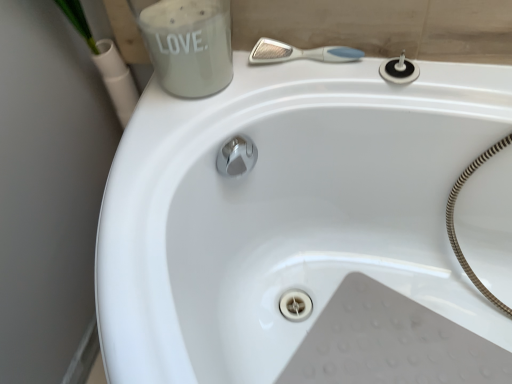
Question: Is white frosted glass jar at upper left taller or shorter than black rubber drain at upper right?

Choices:
 (A) short
 (B) tall

Answer: (B)

Question: Choose the correct answer: Is white frosted glass jar at upper left inside black rubber drain at upper right or outside it?

Choices:
 (A) outside
 (B) inside

Answer: (A)

Question: Which is nearer to the white plastic shower at upper center?

Choices:
 (A) white frosted glass jar at upper left
 (B) black rubber drain at upper right

Answer: (B)

Question: Estimate the real-world distances between objects in this image. Which object is closer to the black rubber drain at upper right?

Choices:
 (A) white frosted glass jar at upper left
 (B) white plastic shower at upper center

Answer: (B)